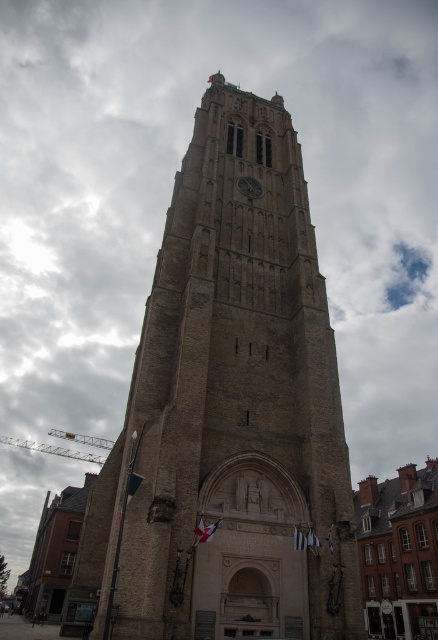
Between brown stone tower at center and dark gray stone clock at center, which one appears on the right side from the viewer's perspective?

dark gray stone clock at center

Who is more distant from viewer, [156,579] or [244,182]?

The point [244,182] is behind.

Where is `brown stone tower at center`? brown stone tower at center is located at coordinates (230, 412).